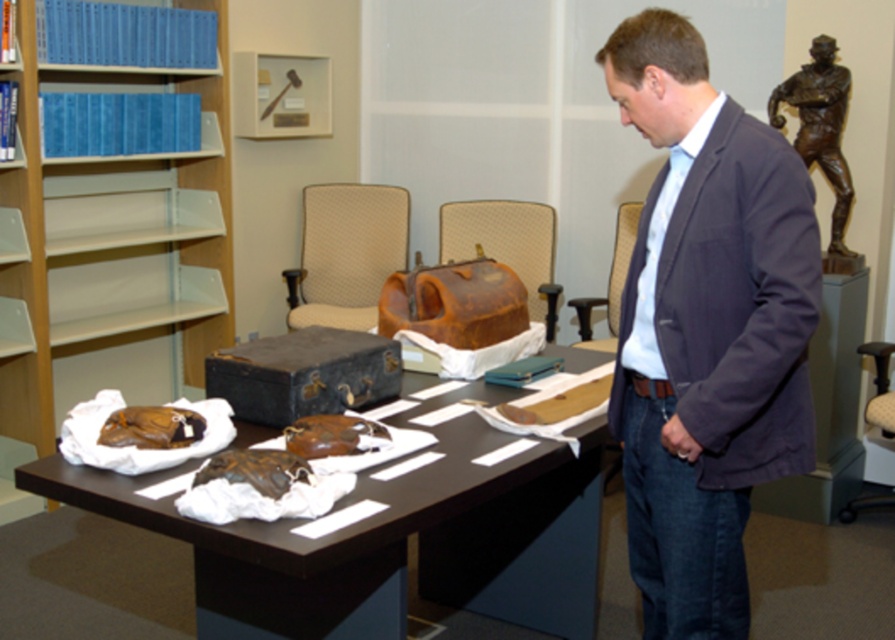
You are a museum curator who needs to remove the dark gray blazer at center and the brown leather gloves at center from the display table. Which item should you remove first to avoid disturbing the other?

You should remove the dark gray blazer at center first because it is positioned over the brown leather gloves at center, so removing it first will prevent disturbing the gloves underneath.

You are a security guard in the museum. You need to check if the dark gray blazer at center is positioned to the right or left of the bronze statue at upper right. According to the scene, which side is it on?

The dark gray blazer at center is to the left of the bronze statue at upper right.

You are a security guard in the museum and need to determine if the dark gray blazer at center can be placed on a shelf that can only hold items narrower than the bronze statue at upper right. Can it fit?

The dark gray blazer at center is wider than the bronze statue at upper right, so it cannot fit on the shelf designed for items narrower than the bronze statue at upper right.